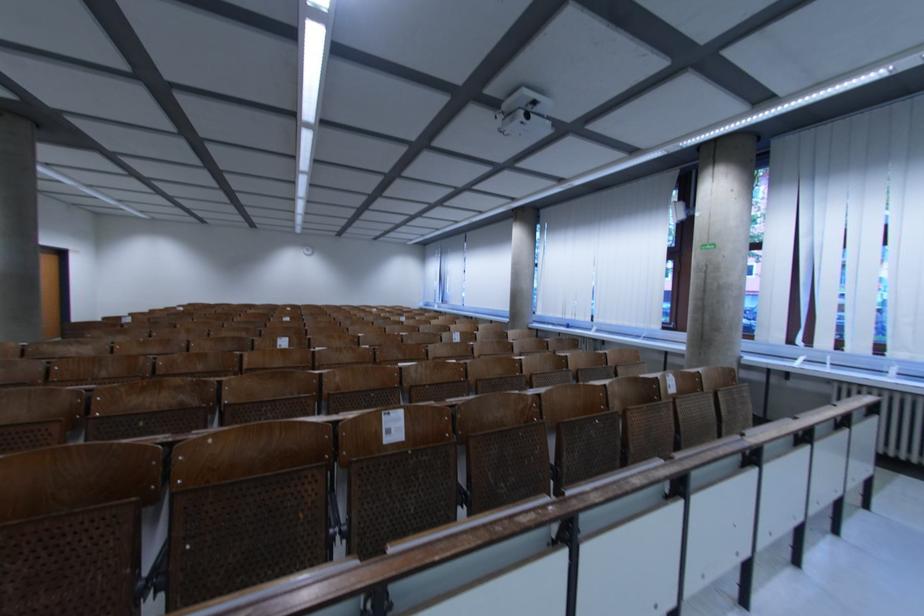
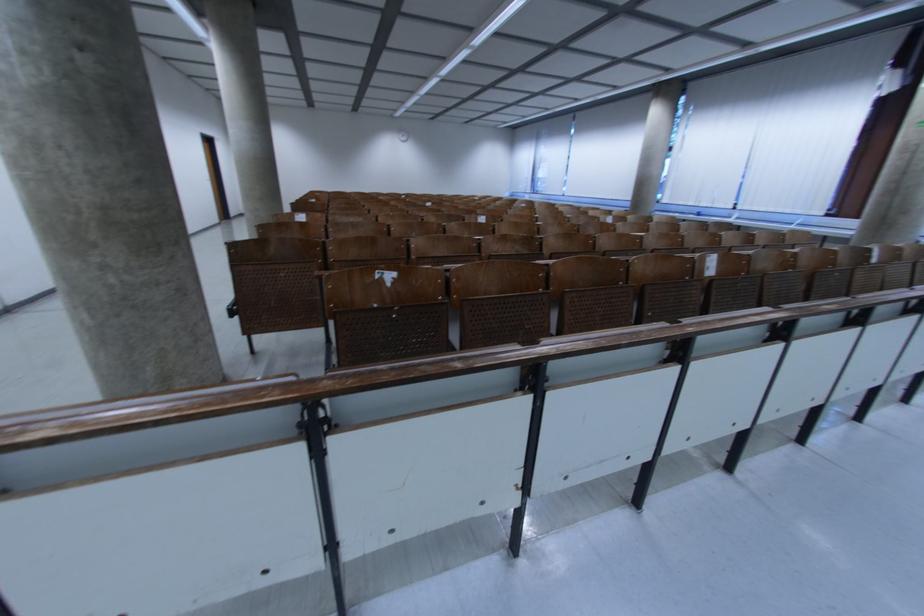
Find the pixel in the second image that matches pixel 541 268 in the first image.

(675, 152)